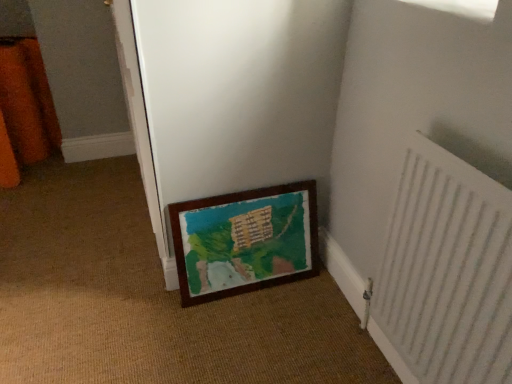
I want to click on free spot to the left of wooden frame at lower center, so click(67, 216).